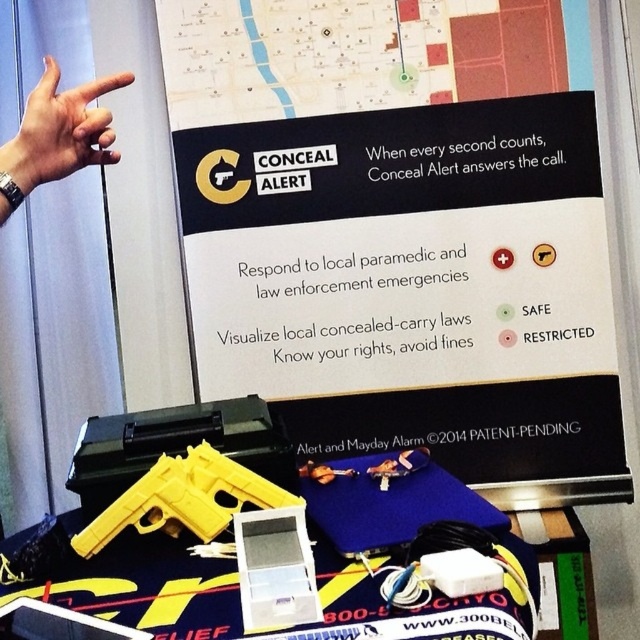
You are a visitor at the Conceal Alert promotional display. You notice two yellow plastic guns displayed. The yellow plastic gun at lower left and the yellow plastic handgun at lower center. Which one is placed higher?

The yellow plastic gun at lower left is positioned over the yellow plastic handgun at lower center, so it is placed higher.

You are a safety inspector standing 6 feet away from the yellow plastic gun at lower left. Can you safely pick it up without entering the restricted zone marked on the poster?

The distance between you and the yellow plastic gun at lower left is 5.56 feet, which is within the 6 feet range. Since the restricted zone is indicated by the red icon on the poster, but the exact location isn not specified, it is safer to assume the area around the gun might be restricted. Therefore, you should not pick it up without further confirmation.